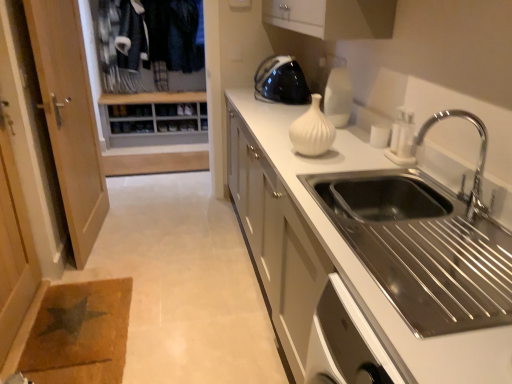
Question: Considering the relative positions of white matte countertop at center and wooden shoe rack at upper left in the image provided, is white matte countertop at center to the right of wooden shoe rack at upper left from the viewer's perspective?

Choices:
 (A) yes
 (B) no

Answer: (A)

Question: Is white matte countertop at center oriented away from wooden shoe rack at upper left?

Choices:
 (A) yes
 (B) no

Answer: (B)

Question: Can you confirm if white matte countertop at center is smaller than wooden shoe rack at upper left?

Choices:
 (A) yes
 (B) no

Answer: (B)

Question: Is white matte countertop at center at the left side of wooden shoe rack at upper left?

Choices:
 (A) yes
 (B) no

Answer: (B)

Question: From the image's perspective, is white matte countertop at center over wooden shoe rack at upper left?

Choices:
 (A) no
 (B) yes

Answer: (A)

Question: Does white matte countertop at center turn towards wooden shoe rack at upper left?

Choices:
 (A) no
 (B) yes

Answer: (A)

Question: Considering the relative positions of white matte vase at center and chrome metallic faucet at upper right in the image provided, is white matte vase at center behind chrome metallic faucet at upper right?

Choices:
 (A) no
 (B) yes

Answer: (B)

Question: Is white matte vase at center taller than chrome metallic faucet at upper right?

Choices:
 (A) no
 (B) yes

Answer: (A)

Question: Is white matte vase at center wider than chrome metallic faucet at upper right?

Choices:
 (A) yes
 (B) no

Answer: (B)

Question: Is white matte vase at center positioned far away from chrome metallic faucet at upper right?

Choices:
 (A) yes
 (B) no

Answer: (B)

Question: From a real-world perspective, is white matte vase at center over chrome metallic faucet at upper right?

Choices:
 (A) no
 (B) yes

Answer: (A)

Question: Is white matte vase at center at the right side of chrome metallic faucet at upper right?

Choices:
 (A) yes
 (B) no

Answer: (B)

Question: From the image's perspective, is wooden shoe rack at upper left located above chrome metallic faucet at upper right?

Choices:
 (A) yes
 (B) no

Answer: (A)